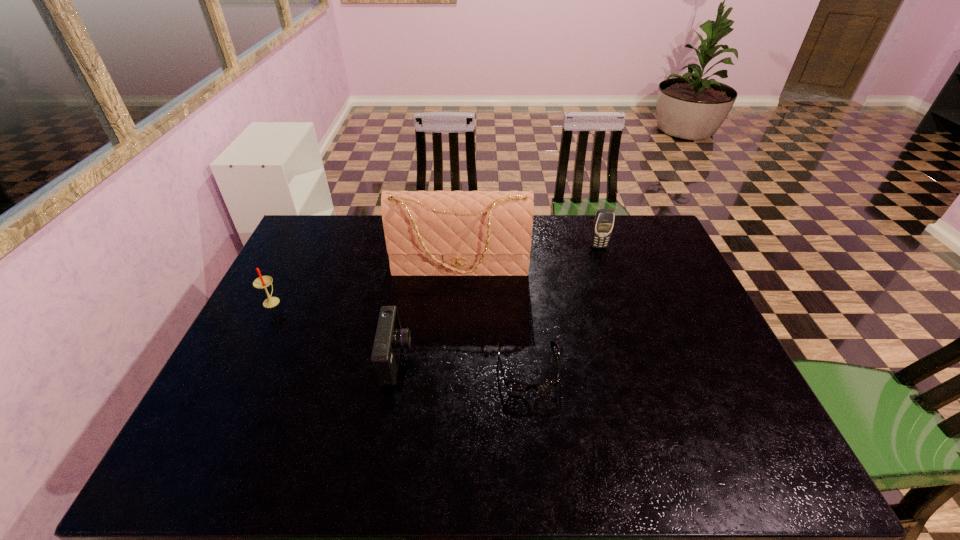
Find the location of a particular element. The width and height of the screenshot is (960, 540). the tallest object is located at coordinates (428, 233).

What are the coordinates of `the fourth nearest object` in the screenshot? It's located at (428, 233).

This screenshot has height=540, width=960. I want to click on the farthest object, so click(x=603, y=225).

I want to click on cellular telephone, so click(x=603, y=225).

You are a GUI agent. You are given a task and a screenshot of the screen. Output one action in this format:
    pyautogui.click(x=<x>, y=<y>)
    Task: Click on the leftmost object
    
    Given the screenshot: What is the action you would take?
    pyautogui.click(x=262, y=282)

At what (x,y) coordinates should I click in order to perform the action: click on the third nearest object. Please return your answer as a coordinate pair (x, y). Looking at the image, I should click on (262, 282).

I want to click on camera, so pyautogui.click(x=390, y=337).

Identify the location of spectacles. The width and height of the screenshot is (960, 540). (511, 384).

Find the location of a particular element. The width and height of the screenshot is (960, 540). vacant space located on the front-facing side of the handbag is located at coordinates (457, 338).

At what (x,y) coordinates should I click in order to perform the action: click on free space located on the front face of the cellular telephone. Please return your answer as a coordinate pair (x, y). Image resolution: width=960 pixels, height=540 pixels. Looking at the image, I should click on (625, 324).